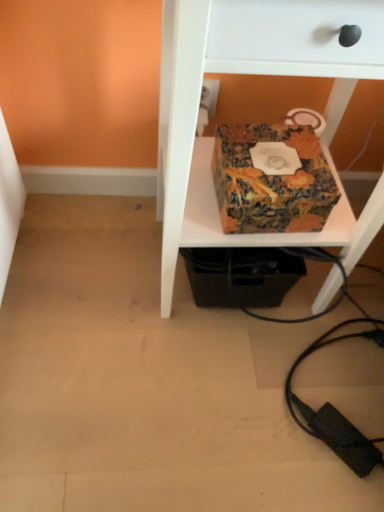
Question: Choose the correct answer: Is multicolored fabric box at center inside marbled paper box at center or outside it?

Choices:
 (A) outside
 (B) inside

Answer: (A)

Question: Does point (359, 59) appear closer or farther from the camera than point (302, 194)?

Choices:
 (A) farther
 (B) closer

Answer: (B)

Question: Is multicolored fabric box at center taller or shorter than marbled paper box at center?

Choices:
 (A) tall
 (B) short

Answer: (A)

Question: Is marbled paper box at center to the left or to the right of multicolored fabric box at center in the image?

Choices:
 (A) right
 (B) left

Answer: (B)

Question: Is marbled paper box at center inside the boundaries of multicolored fabric box at center, or outside?

Choices:
 (A) outside
 (B) inside

Answer: (B)

Question: Relative to multicolored fabric box at center, is marbled paper box at center in front or behind?

Choices:
 (A) behind
 (B) front

Answer: (A)

Question: Is marbled paper box at center taller or shorter than multicolored fabric box at center?

Choices:
 (A) tall
 (B) short

Answer: (B)